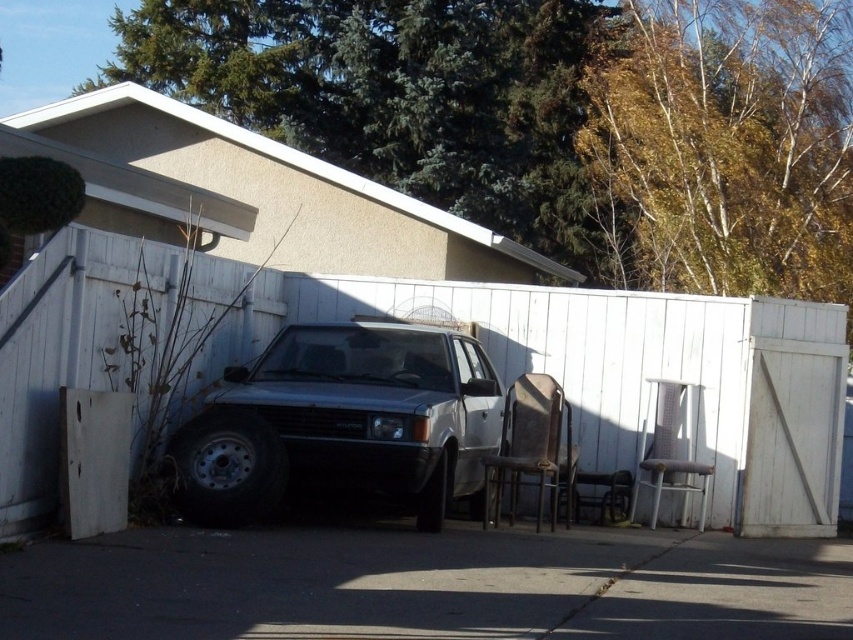
You are driving a car and want to park it on the dark asphalt driveway at center. However, there is already a satin silver car at center parked there. Based on their positions, which side of the driveway should you pull over to?

The dark asphalt driveway at center is to the left of the satin silver car at center, so you should pull over to the right side of the driveway to park.

You are standing at the point marked as point (426,586) in the image. What is the material of the surface you are currently standing on?

The surface at point (426,586) is dark asphalt driveway at center.

You are trying to park a car that is 1.5 meters tall. The satin silver car at center is parked on the dark asphalt driveway at center. Can the driveway accommodate your car in terms of height?

The dark asphalt driveway at center has a lesser height compared to satin silver car at center, which means the driveway is lower than the car. Since your car is 1.5 meters tall, it might not fit if the driveway has height restrictions. However, the description only mentions the driveway being shorter in height than the car currently parked there. Without specific measurements for the driveway height, it is uncertain if it can accommodate your car.